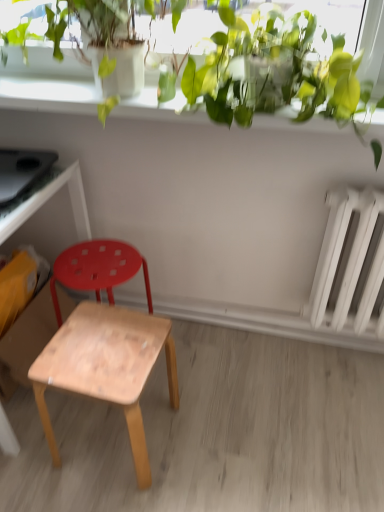
Locate an element on the screen. This screenshot has width=384, height=512. free space underneath natural wood stool at center, which is the first stool in front-to-back order (from a real-world perspective) is located at coordinates (107, 440).